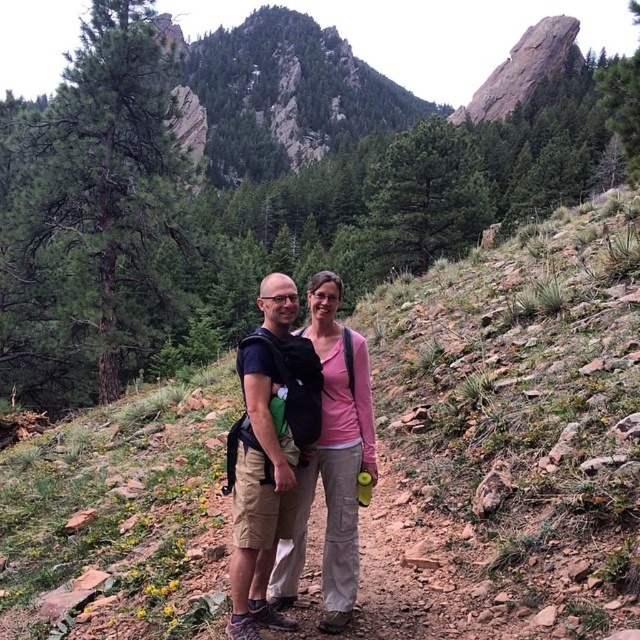
You are navigating a narrow hiking trail and need to pass two points marked on your map. The first point is at coordinates point (113,570) and the second is at point (259,497). Which point should you reach first if you are moving forward along the trail?

You should reach point (259,497) first because point (113,570) is located behind it along the trail.